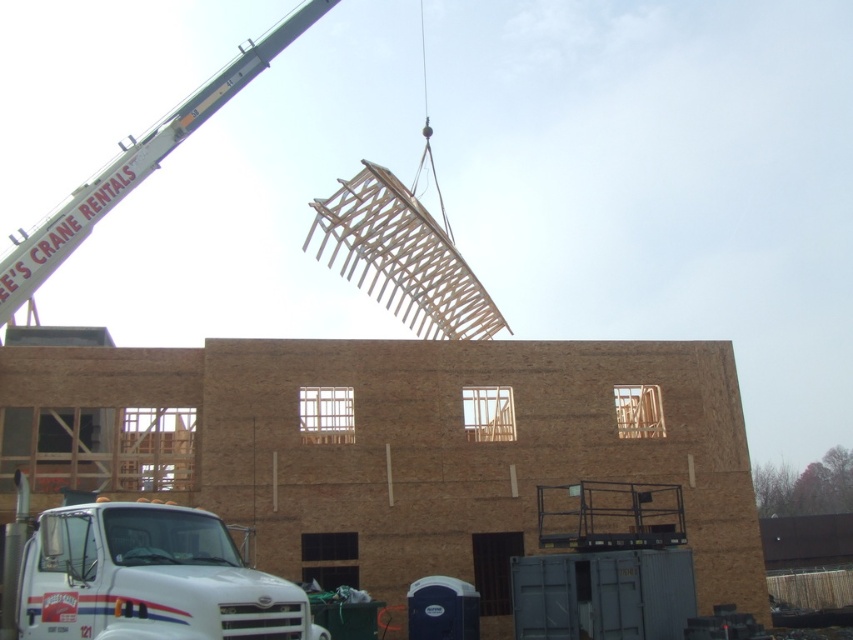
Question: Is white glossy truck at lower left smaller than white painted metal crane at upper left?

Choices:
 (A) yes
 (B) no

Answer: (A)

Question: Is the position of white glossy truck at lower left more distant than that of white painted metal crane at upper left?

Choices:
 (A) no
 (B) yes

Answer: (A)

Question: Is white glossy truck at lower left positioned before white painted metal crane at upper left?

Choices:
 (A) no
 (B) yes

Answer: (B)

Question: Among these points, which one is farthest from the camera?

Choices:
 (A) pyautogui.click(x=160, y=161)
 (B) pyautogui.click(x=181, y=620)

Answer: (A)